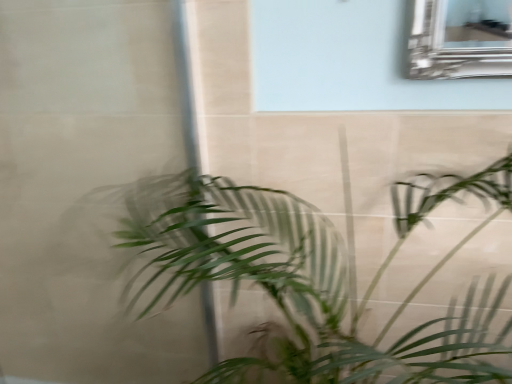
Question: Does transparent glass door at left have a lesser height compared to green leafy plant at center?

Choices:
 (A) no
 (B) yes

Answer: (A)

Question: Does transparent glass door at left appear on the right side of green leafy plant at center?

Choices:
 (A) no
 (B) yes

Answer: (A)

Question: Does transparent glass door at left have a greater height compared to green leafy plant at center?

Choices:
 (A) no
 (B) yes

Answer: (B)

Question: Would you say transparent glass door at left is a long distance from green leafy plant at center?

Choices:
 (A) yes
 (B) no

Answer: (B)

Question: Could you tell me if transparent glass door at left is facing green leafy plant at center?

Choices:
 (A) yes
 (B) no

Answer: (A)

Question: Considering the relative sizes of transparent glass door at left and green leafy plant at center in the image provided, is transparent glass door at left smaller than green leafy plant at center?

Choices:
 (A) no
 (B) yes

Answer: (B)

Question: Is green leafy plant at center thinner than transparent glass door at left?

Choices:
 (A) yes
 (B) no

Answer: (B)

Question: Can you confirm if green leafy plant at center is taller than transparent glass door at left?

Choices:
 (A) no
 (B) yes

Answer: (A)

Question: From a real-world perspective, is green leafy plant at center over transparent glass door at left?

Choices:
 (A) no
 (B) yes

Answer: (A)

Question: Is green leafy plant at center bigger than transparent glass door at left?

Choices:
 (A) no
 (B) yes

Answer: (B)

Question: Does green leafy plant at center have a smaller size compared to transparent glass door at left?

Choices:
 (A) yes
 (B) no

Answer: (B)

Question: Can you confirm if green leafy plant at center is positioned to the left of transparent glass door at left?

Choices:
 (A) yes
 (B) no

Answer: (B)

Question: Looking at their shapes, would you say transparent glass door at left is wider or thinner than green leafy plant at center?

Choices:
 (A) thin
 (B) wide

Answer: (A)